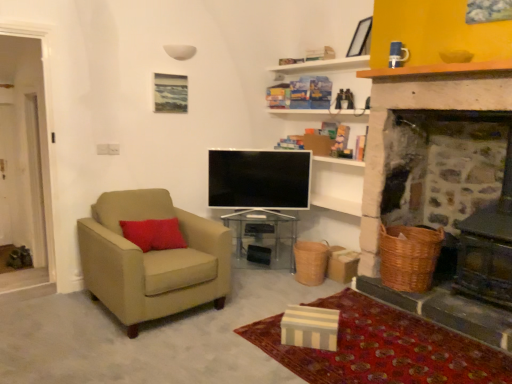
Locate an element on the screen. This screenshot has width=512, height=384. free space in front of braided wicker basket at lower center, the 2th basket positioned from the front is located at coordinates (309, 287).